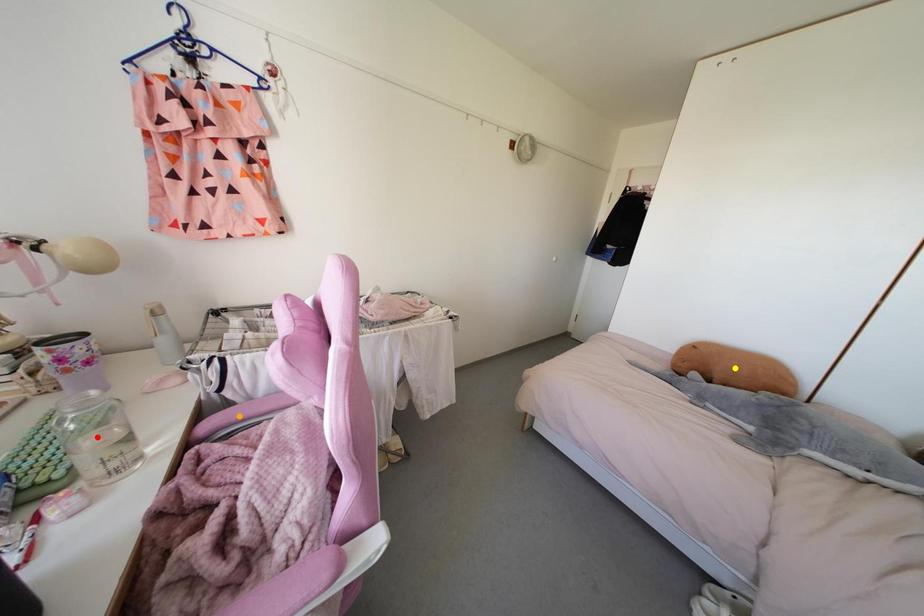
Order these from nearest to farthest:
1. orange point
2. red point
3. yellow point

yellow point
orange point
red point